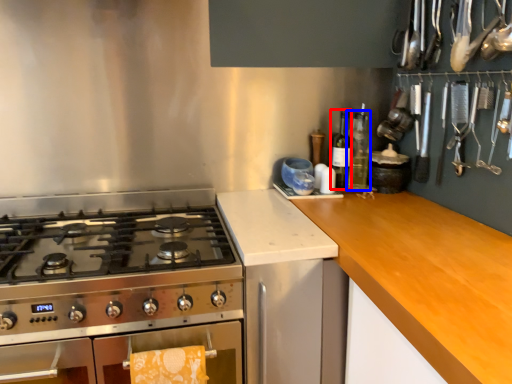
Question: Which point is closer to the camera, bottle (highlighted by a red box) or bottle (highlighted by a blue box)?

Choices:
 (A) bottle
 (B) bottle

Answer: (A)